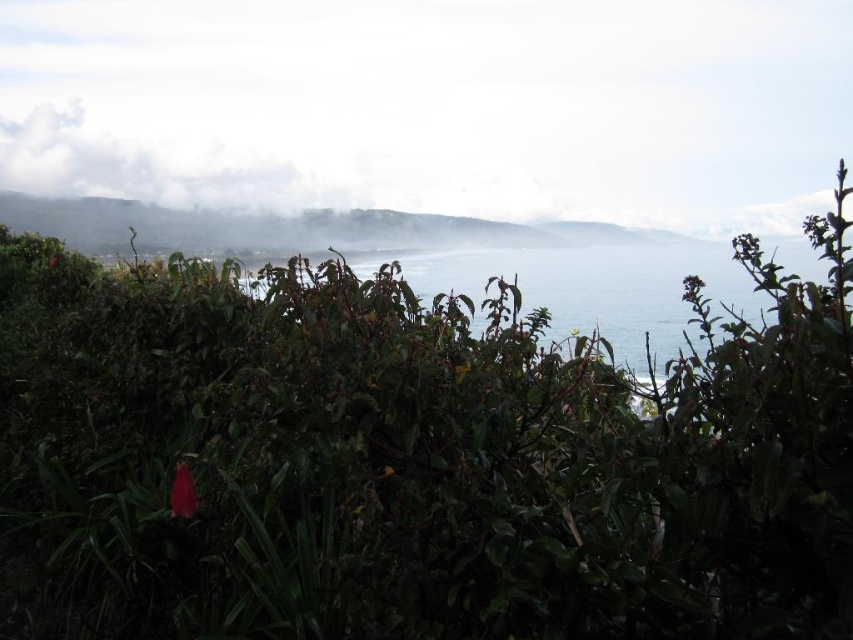
You are standing at the scenic spot and want to take a photo that includes both the blue water at center and the white fluffy cloud at upper left. Based on their positions, which object should you focus on first to ensure both are in clear view?

You should focus on the blue water at center first because it is closer to the viewer than the white fluffy cloud at upper left, so adjusting focus starting from the closer object ensures both are in clear view.

You are standing at the point marked as point [412,458] in the image. What is the nearest object to you in the scene?

The nearest object to you at point [412,458] is the green leafy bush at center.

Based on the photo, you are standing at the point closer to the camera in the image. Which point are you at, point (666, 316) or point (115, 189)?

You are at point (666, 316) because it is closer to the camera than point (115, 189).